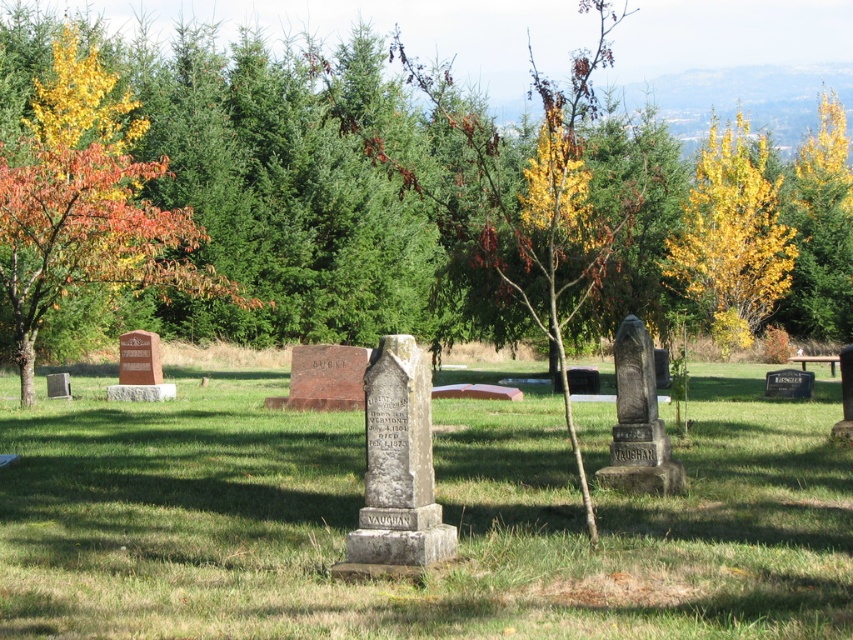
Question: Among these objects, which one is farthest from the camera?

Choices:
 (A) orange leafy tree at left
 (B) green grass at center
 (C) yellow leafy tree at upper right
 (D) yellow leafy tree at center

Answer: (C)

Question: Which object is closer to the camera taking this photo?

Choices:
 (A) yellow leafy tree at upper right
 (B) orange leafy tree at left

Answer: (B)

Question: Which point appears closest to the camera in this image?

Choices:
 (A) click(216, 220)
 (B) click(769, 292)

Answer: (A)

Question: Is green grass at center thinner than yellow leafy tree at center?

Choices:
 (A) yes
 (B) no

Answer: (A)

Question: In this image, where is green grass at center located relative to yellow leafy tree at upper right?

Choices:
 (A) right
 (B) left

Answer: (B)

Question: Does yellow leafy tree at center appear on the right side of orange leafy tree at left?

Choices:
 (A) yes
 (B) no

Answer: (A)